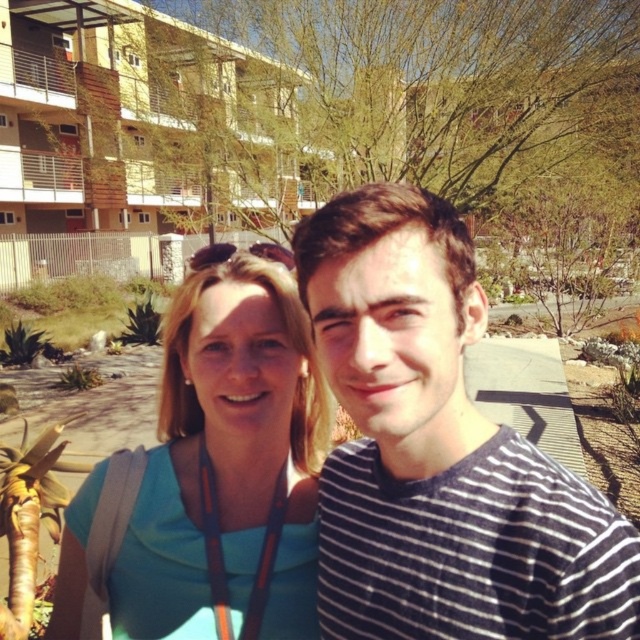
Question: In this image, where is striped cotton shirt at center located relative to blue fabric shirt at center?

Choices:
 (A) below
 (B) above

Answer: (B)

Question: Does striped cotton shirt at center have a smaller size compared to blue fabric shirt at center?

Choices:
 (A) no
 (B) yes

Answer: (B)

Question: Which object appears closest to the camera in this image?

Choices:
 (A) striped cotton shirt at center
 (B) blue fabric shirt at center

Answer: (A)

Question: Is striped cotton shirt at center further to the viewer compared to blue fabric shirt at center?

Choices:
 (A) yes
 (B) no

Answer: (B)